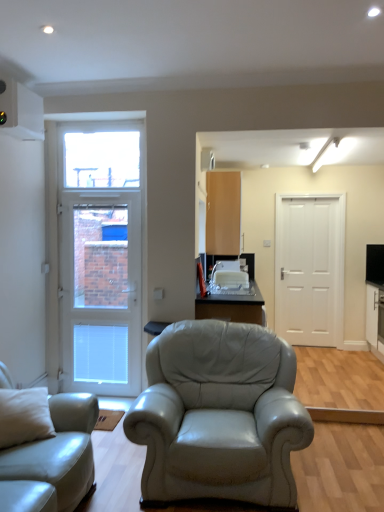
Question: Is white glossy door at left, the first door when ordered from front to back, taller or shorter than white glossy cabinet at right?

Choices:
 (A) tall
 (B) short

Answer: (A)

Question: From a real-world perspective, relative to white glossy cabinet at right, is white glossy door at left, the 2th door viewed from the right, vertically above or below?

Choices:
 (A) below
 (B) above

Answer: (B)

Question: Which of these objects is positioned farthest from the light beige leather couch at lower left?

Choices:
 (A) white matte door at right, which is the 2th door in left-to-right order
 (B) matte black table at center
 (C) white glossy cabinet at right
 (D) transparent glass window at upper left
 (E) matte wood cabinet at upper center

Answer: (E)

Question: Considering the real-world distances, which object is farthest from the transparent glass window at upper left?

Choices:
 (A) white glossy cabinet at right
 (B) white matte door at right, which is the 1th door in right-to-left order
 (C) light beige leather couch at lower left
 (D) matte black table at center
 (E) matte wood cabinet at upper center

Answer: (C)